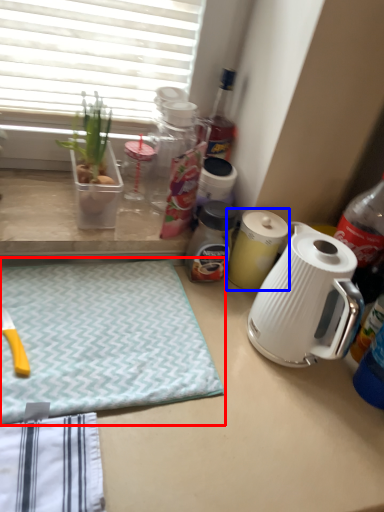
Question: Which of the following is the closest to the observer, yoga mat (highlighted by a red box) or kitchen appliance (highlighted by a blue box)?

Choices:
 (A) yoga mat
 (B) kitchen appliance

Answer: (A)